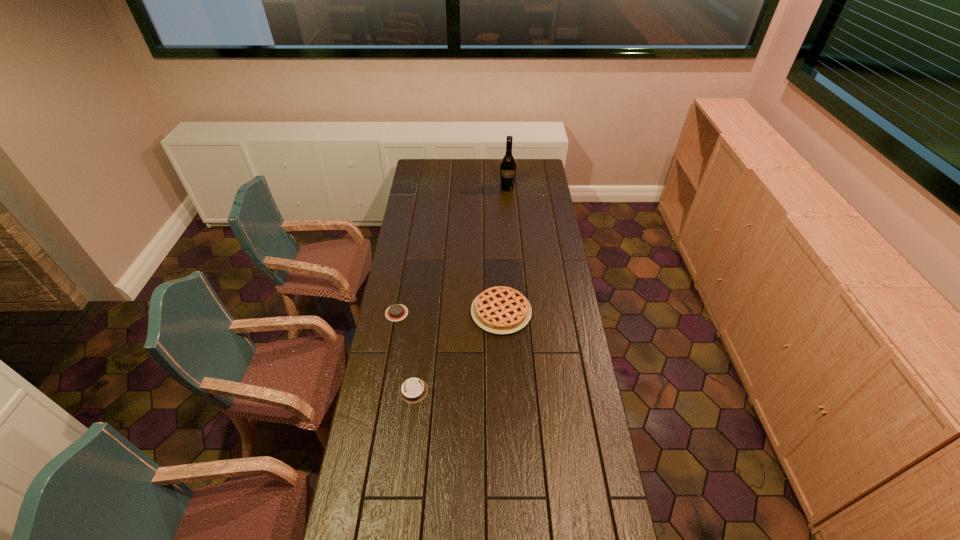
Where is `vacant space positioned 0.300m on the front of the leftmost object`? The width and height of the screenshot is (960, 540). vacant space positioned 0.300m on the front of the leftmost object is located at coordinates (385, 382).

The width and height of the screenshot is (960, 540). In order to click on vacant point at the far edge in this screenshot , I will do `click(470, 160)`.

In the image, there is a desktop. At what (x,y) coordinates should I click in order to perform the action: click on vacant space at the left edge. Please return your answer as a coordinate pair (x, y). This screenshot has height=540, width=960. Looking at the image, I should click on (366, 456).

Identify the location of vacant region at the right edge of the desktop. The image size is (960, 540). (542, 228).

Locate an element on the screen. free point between the farther chocolate cake and the right chocolate cake is located at coordinates [x=405, y=352].

Where is `free space that is in between the wine bottle and the leftmost object`? This screenshot has height=540, width=960. free space that is in between the wine bottle and the leftmost object is located at coordinates (452, 251).

Locate an element on the screen. empty space between the tallest object and the third object from right to left is located at coordinates (461, 289).

Find the location of a particular element. free spot between the wine bottle and the farther chocolate cake is located at coordinates (452, 251).

Find the location of a particular element. Image resolution: width=960 pixels, height=540 pixels. vacant point located between the right chocolate cake and the left chocolate cake is located at coordinates (405, 352).

Locate an element on the screen. The image size is (960, 540). free spot between the pie and the farther chocolate cake is located at coordinates (449, 313).